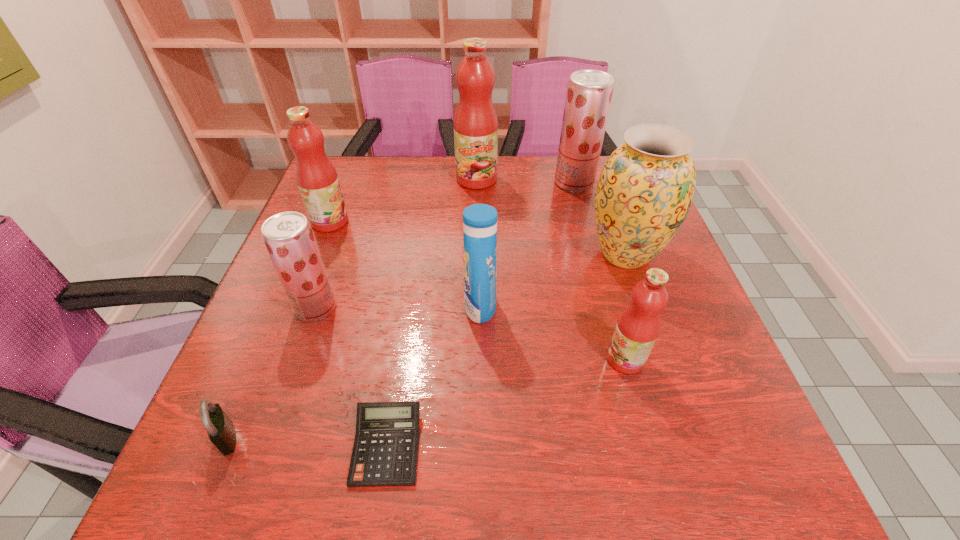
Locate an element on the screen. The height and width of the screenshot is (540, 960). the smallest pink fruit juice is located at coordinates (637, 328).

The image size is (960, 540). Identify the location of the nearest pink fruit juice. (637, 328).

Where is `black padlock`? This screenshot has height=540, width=960. black padlock is located at coordinates (221, 431).

At what (x,y) coordinates should I click in order to perform the action: click on padlock. Please return your answer as a coordinate pair (x, y). Looking at the image, I should click on (221, 431).

Identify the location of the shortest object. (385, 451).

Identify the location of the fourth object from left to right. (385, 451).

You are a GUI agent. You are given a task and a screenshot of the screen. Output one action in this format:
    pyautogui.click(x=<x>, y=<y>)
    Task: Click on the free spot located 0.090m on the front label of the tallest object
    This screenshot has height=540, width=960.
    Given the screenshot: What is the action you would take?
    pos(476,210)

Locate an element on the screen. The height and width of the screenshot is (540, 960). free space located 0.090m on the front of the farther strawberry fruit juice is located at coordinates (583, 213).

Identify the location of vacant space positioned on the front label of the second nearest pink fruit juice. (387, 222).

What are the coordinates of `free location located on the front of the yellow vase` in the screenshot? It's located at (646, 314).